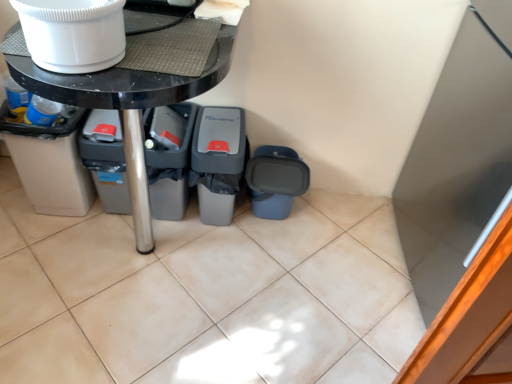
Locate an element on the screen. blank area beneath blue matte recycling bin at lower right, which appears as the 1th recycling bin when viewed from the right (from a real-world perspective) is located at coordinates (275, 221).